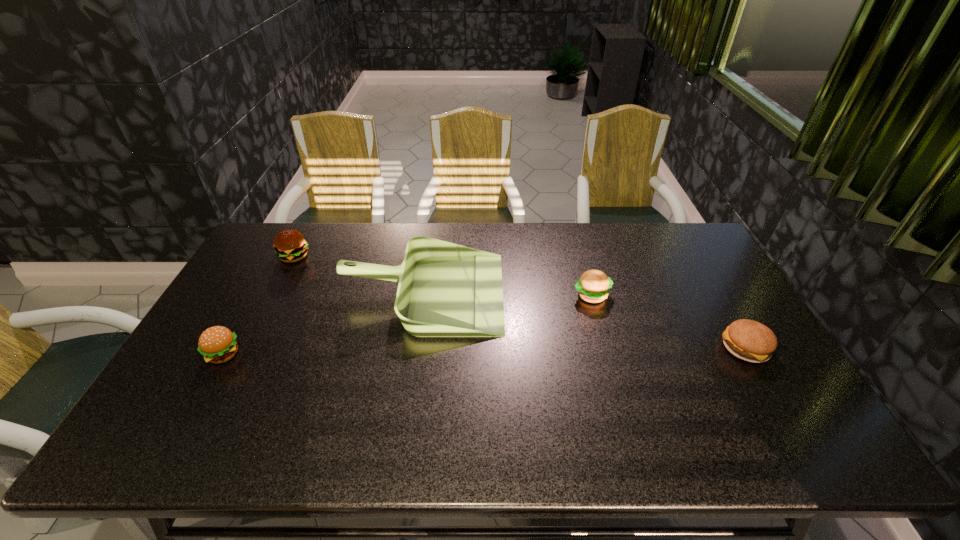
Where is `vacant space located on the left of the shortest hamburger`? vacant space located on the left of the shortest hamburger is located at coordinates (658, 348).

Locate an element on the screen. This screenshot has width=960, height=540. dustpan present at the far edge is located at coordinates (445, 290).

This screenshot has width=960, height=540. I want to click on hamburger present at the far edge, so click(290, 245).

The image size is (960, 540). I want to click on object situated at the right edge, so click(x=748, y=340).

Locate an element on the screen. object that is positioned at the far left corner is located at coordinates (290, 245).

This screenshot has width=960, height=540. In the image, there is a desktop. In order to click on vacant area at the far edge in this screenshot , I will do `click(612, 234)`.

In the image, there is a desktop. Identify the location of free space at the near edge. (511, 449).

In the image, there is a desktop. What are the coordinates of `free space at the right edge` in the screenshot? It's located at (708, 306).

Locate an element on the screen. This screenshot has width=960, height=540. vacant space at the far right corner of the desktop is located at coordinates (660, 249).

Locate an element on the screen. This screenshot has width=960, height=540. free point between the second farthest hamburger and the shortest object is located at coordinates (668, 321).